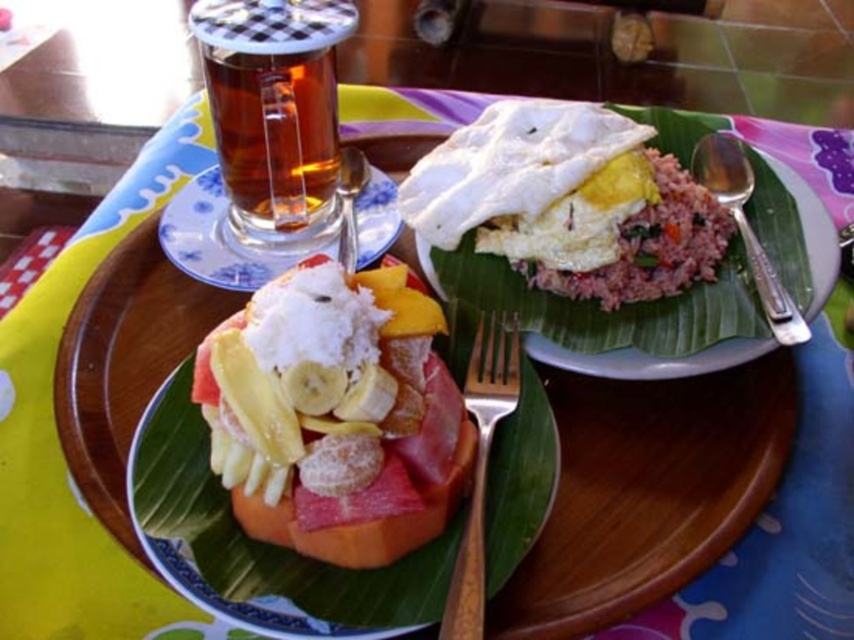
The width and height of the screenshot is (854, 640). Identify the location of clear glass cup at upper left. (225, 240).

This screenshot has width=854, height=640. I want to click on clear glass cup at upper left, so click(225, 240).

Is smooth papaya at center positioned in front of translucent glass mug at upper left?

Yes, it is.

Who is more forward, (373, 618) or (302, 214)?

Positioned in front is point (373, 618).

The width and height of the screenshot is (854, 640). In order to click on smooth papaya at center in this screenshot , I will do `click(262, 545)`.

Can you confirm if clear glass cup at upper left is bigger than silver metallic spoon at upper right?

Correct, clear glass cup at upper left is larger in size than silver metallic spoon at upper right.

Measure the distance between point (258,259) and camera.

Point (258,259) is 15.38 inches away from camera.

Is point (220, 244) positioned in front of point (711, 180)?

Yes, point (220, 244) is closer to viewer.

This screenshot has width=854, height=640. In order to click on clear glass cup at upper left in this screenshot , I will do `click(225, 240)`.